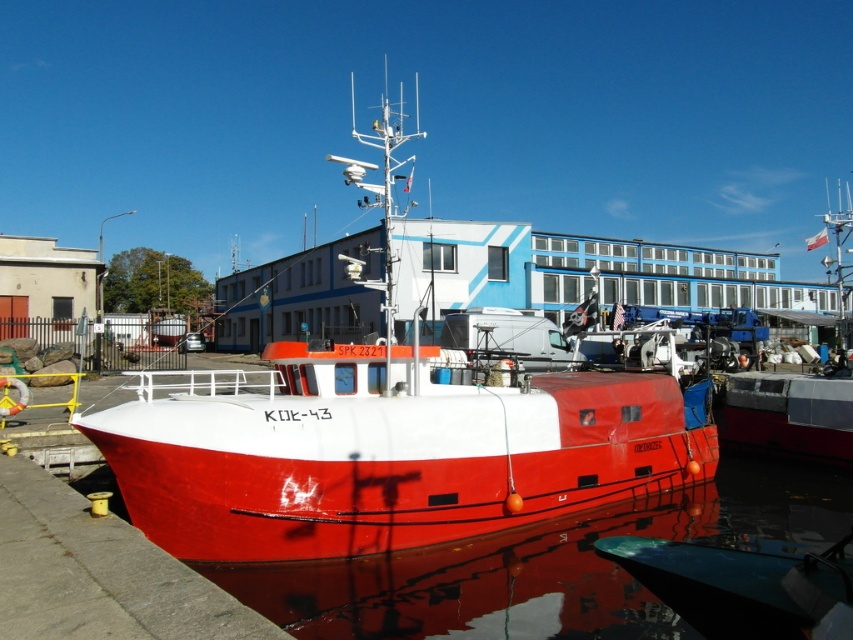
Question: Which point is closer to the camera taking this photo?

Choices:
 (A) (326, 493)
 (B) (834, 403)
 (C) (491, 554)

Answer: (A)

Question: Observing the image, what is the correct spatial positioning of shiny red boat at center in reference to red matte boat at center?

Choices:
 (A) above
 (B) below

Answer: (A)

Question: Is glossy water at boat front closer to camera compared to red matte boat at center?

Choices:
 (A) yes
 (B) no

Answer: (A)

Question: Which of the following is the farthest from the observer?

Choices:
 (A) glossy water at boat front
 (B) shiny red boat at center
 (C) red matte boat at center

Answer: (C)

Question: Can you confirm if shiny red boat at center is positioned below glossy water at boat front?

Choices:
 (A) no
 (B) yes

Answer: (A)

Question: Which object is farther from the camera taking this photo?

Choices:
 (A) glossy water at boat front
 (B) shiny red boat at center
 (C) red matte boat at center

Answer: (C)